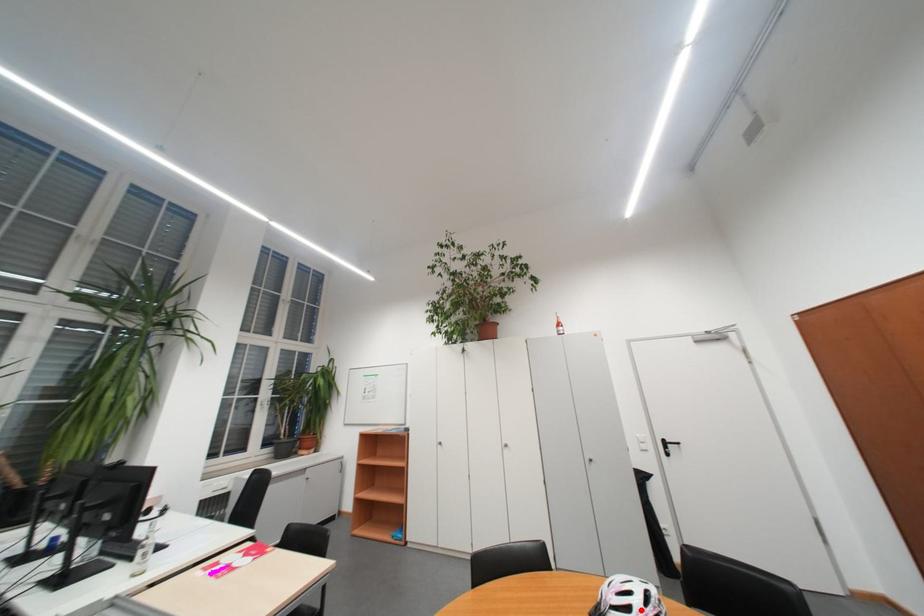
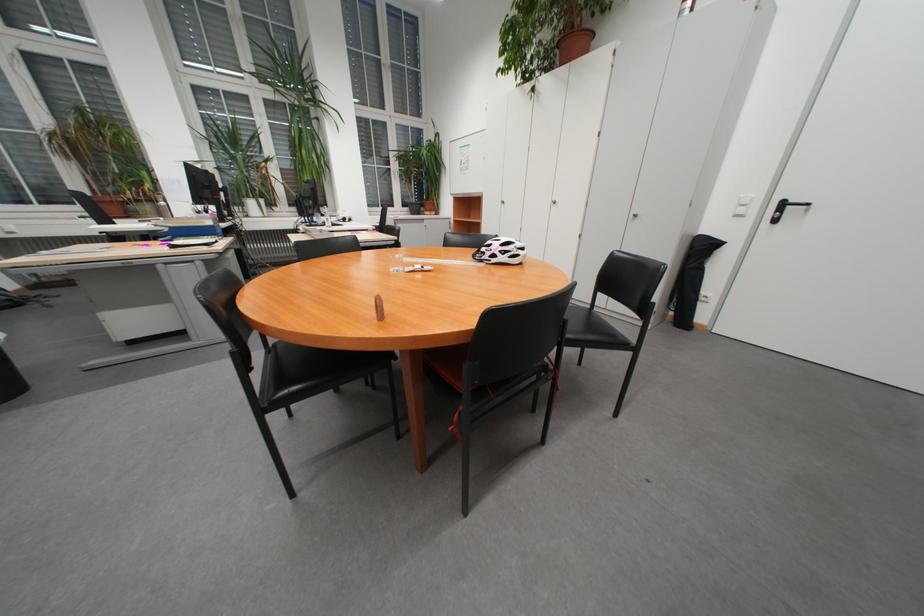
In the second image, find the point that corresponds to the highlighted location in the first image.

(502, 246)